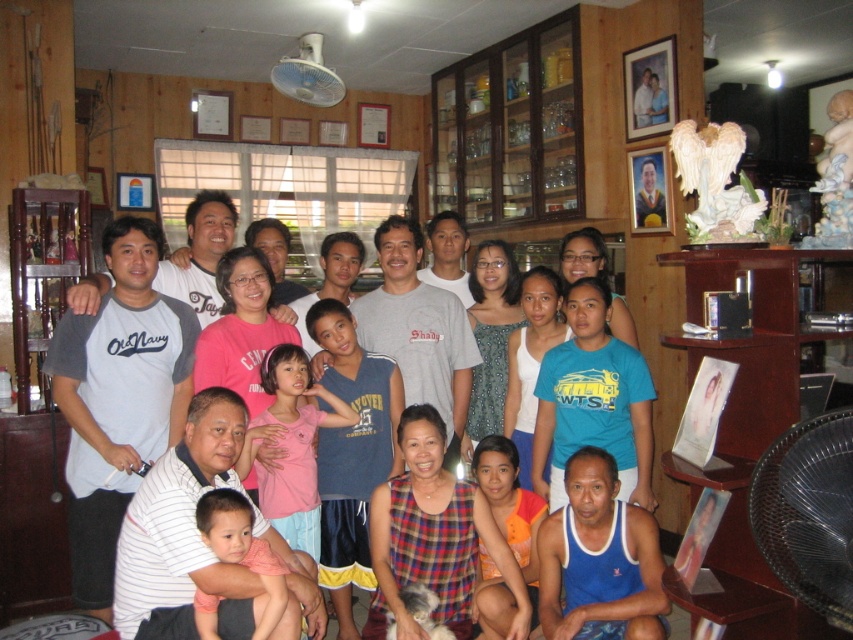
You are standing in the room and want to locate the orange printed shirt at lower center. According to the coordinates provided, where exactly should you look?

The orange printed shirt at lower center is located at point [511,506].

You are trying to identify the people in the photo. There is an orange printed shirt at lower center and a matte pink shirt at center. Which one is located to the right of the other?

The orange printed shirt at lower center is positioned on the right side of matte pink shirt at center.

You are standing in the room and want to hand a gift to the person wearing the white striped shirt at lower left and the person wearing the matte pink shirt at center. Which person is positioned higher in the image?

The white striped shirt at lower left is located above the matte pink shirt at center, so the person wearing the white striped shirt at lower left is positioned higher in the image.